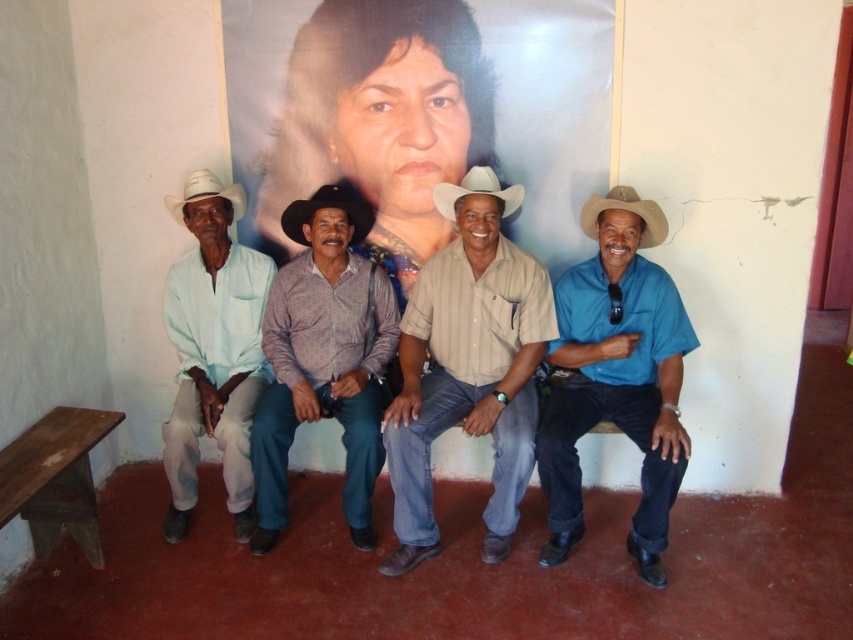
You are taking a photo of the scene and want to focus on both the point at point (619, 346) and the point at point (292, 227). Which point should you focus on first to ensure both are in sharp focus?

You should focus on point (619, 346) first because it is closer to the camera than point (292, 227). By focusing on the closer point, the farther point will also be in focus if within the depth of field range.

You are an observer standing in front of the bench. You notice the blue cotton shirt at right and the black felt cowboy hat at center. Which object is lower in position?

The blue cotton shirt at right is positioned under the black felt cowboy hat at center, so the blue cotton shirt at right is lower.

You are a photographer trying to capture a clear shot of the blue cotton shirt at right and the black felt cowboy hat at center. Since you want to ensure both are in focus, which object should you adjust your camera focus on first based on their sizes?

The blue cotton shirt at right has a greater height compared to the black felt cowboy hat at center. Therefore, you should focus on the blue cotton shirt at right first because larger objects require more precise focus adjustments to ensure clarity.